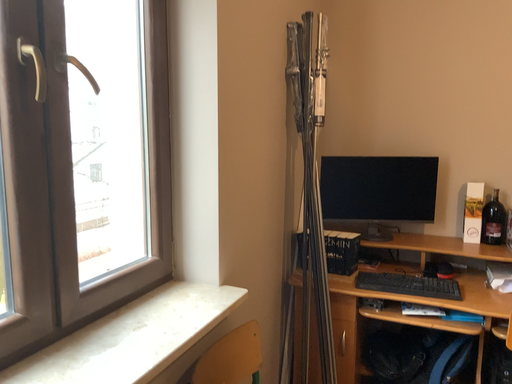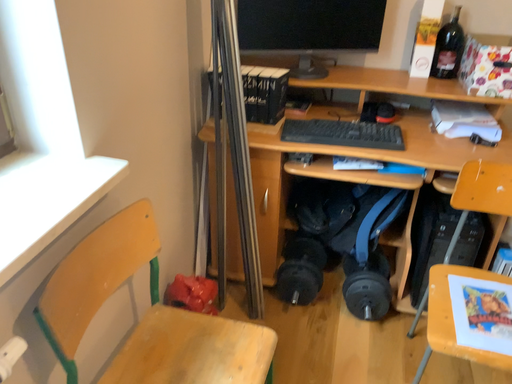
Question: Which way did the camera rotate in the video?

Choices:
 (A) rotated downward
 (B) rotated upward

Answer: (A)